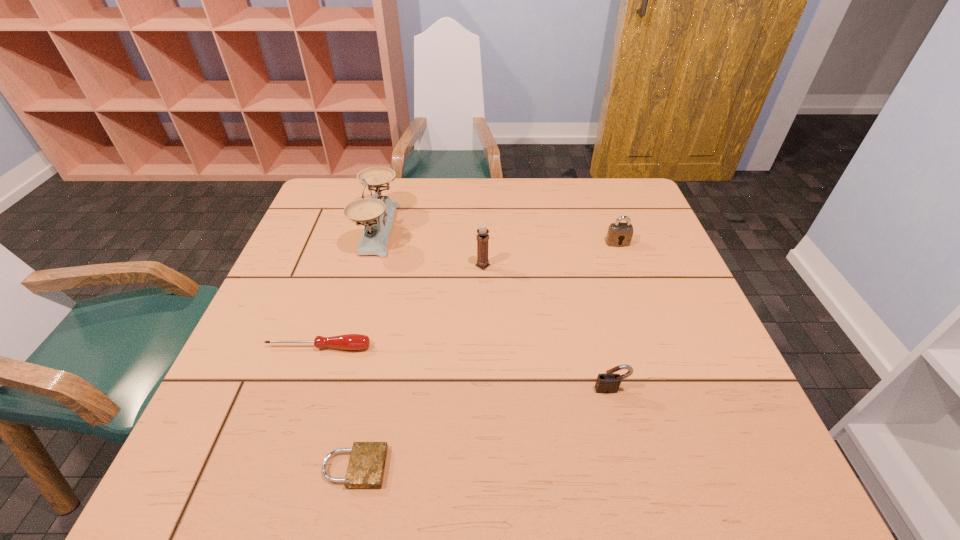
The width and height of the screenshot is (960, 540). In order to click on object at the right edge in this screenshot , I will do `click(619, 234)`.

This screenshot has height=540, width=960. In order to click on vacant space at the far edge of the desktop in this screenshot , I will do `click(579, 191)`.

Identify the location of free spot at the near edge of the desktop. (547, 478).

This screenshot has height=540, width=960. In the image, there is a desktop. Identify the location of vacant space at the left edge. (260, 354).

Where is `vacant point at the right edge`? This screenshot has height=540, width=960. vacant point at the right edge is located at coordinates coord(667,296).

This screenshot has height=540, width=960. In the image, there is a desktop. What are the coordinates of `vacant space at the near left corner` in the screenshot? It's located at (224, 442).

The width and height of the screenshot is (960, 540). I want to click on free location at the far right corner, so click(x=611, y=192).

Find the location of a particular element. vacant space that is in between the third object from right to left and the rightmost object is located at coordinates (550, 254).

Locate an element on the screen. This screenshot has width=960, height=540. free point between the candle holder and the fifth farthest object is located at coordinates (547, 328).

Identify the location of empty location between the fourth farthest object and the third farthest object. (400, 306).